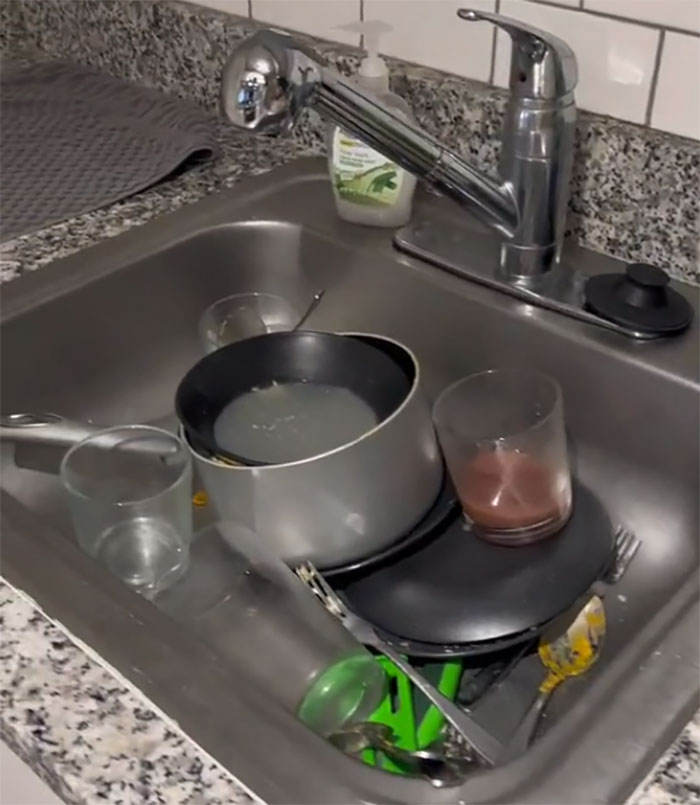
I want to click on dish soap, so click(356, 200).